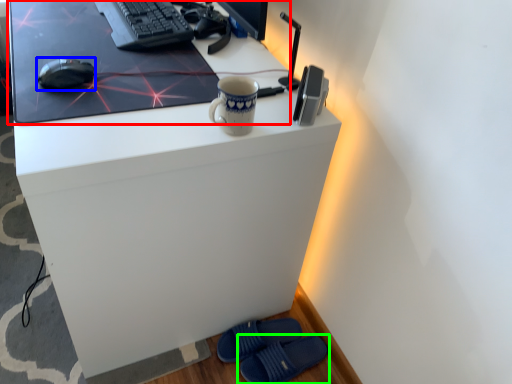
Question: Which object is the farthest from desktop (highlighted by a red box)? Choose among these: mouse (highlighted by a blue box) or footwear (highlighted by a green box).

Choices:
 (A) mouse
 (B) footwear

Answer: (B)